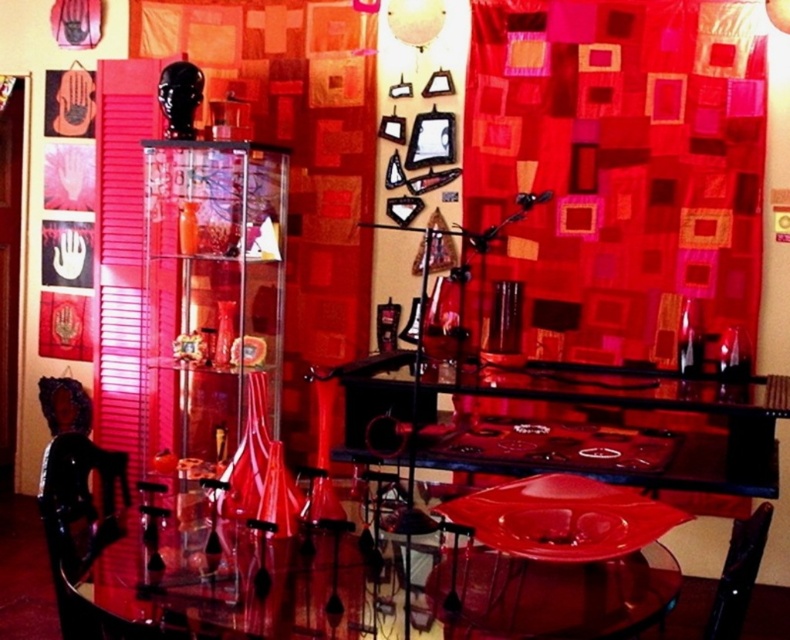
You are sitting in the black leather chair at lower right and want to place a book on the transparent glass table at center. In which direction should you move to reach the table?

The transparent glass table at center is to the left of the black leather chair at lower right, so you should move to your left to reach the table.

You are standing in the room and want to place a 5 feet long sculpture on the transparent glass table at center. Will the sculpture fit on the table?

The transparent glass table at center is 4.88 feet from camera, but the distance from the camera does not indicate the table size. The question cannot be answered with the provided information.